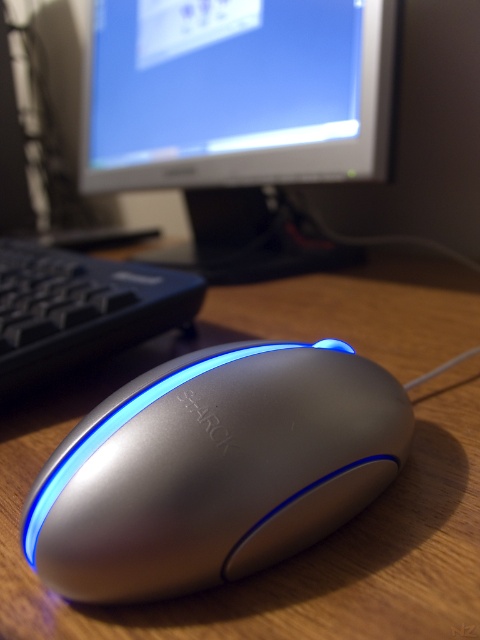
You are trying to reach a point on the desk that is 35.38 inches away from you. The point is labeled as point (291, 152). Can you confirm if this point is closer to the computer monitor or the keyboard?

The point (291, 152) is 35.38 inches away from the camera. Since the keyboard is partially visible to the left of the mouse and the monitor is in the background, the point is closer to the keyboard as it is on the left side of the mouse which is nearer to the camera compared to the monitor.

You are setting up a new workspace and want to ensure there is enough space between the matte plastic monitor at upper center and the black plastic keyboard at left for a 16 inch laptop. Based on the image, will the current spacing accommodate the laptop?

The matte plastic monitor at upper center is 16.53 inches from the black plastic keyboard at left, so the space between them is sufficient to place a 16 inch laptop.

You are taking a photo of the SHARKO mouse on the desk. The point at coordinate point [97,493] is part of the mouse. If your camera requires focusing on an object that is exactly 25 centimeters away, will you need to adjust the focus to capture the mouse clearly?

The point at coordinate point [97,493] is 24.66 centimeters away from the camera, which is slightly closer than the required 25 centimeters. Therefore, you may need to adjust the focus slightly to ensure the mouse is captured clearly.